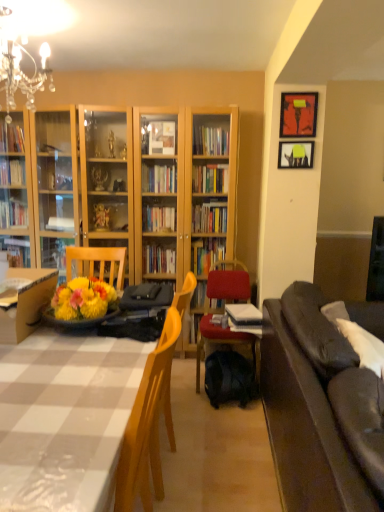
Question: Is dark brown leather couch at right taller than matte black picture frame at upper right, which is counted as the second picture frame, starting from the top?

Choices:
 (A) yes
 (B) no

Answer: (A)

Question: Is dark brown leather couch at right not inside matte black picture frame at upper right, which is the 1th picture frame from bottom to top?

Choices:
 (A) no
 (B) yes

Answer: (B)

Question: Is dark brown leather couch at right at the right side of matte black picture frame at upper right, which is the 1th picture frame from bottom to top?

Choices:
 (A) no
 (B) yes

Answer: (B)

Question: Does dark brown leather couch at right have a lesser width compared to matte black picture frame at upper right, which is the 1th picture frame from bottom to top?

Choices:
 (A) no
 (B) yes

Answer: (A)

Question: Is dark brown leather couch at right surrounding matte black picture frame at upper right, which is the 1th picture frame from bottom to top?

Choices:
 (A) yes
 (B) no

Answer: (B)

Question: In terms of width, does black matte backpack at lower center look wider or thinner when compared to matte black picture frame at upper right, marked as the 1th picture frame in a top-to-bottom arrangement?

Choices:
 (A) thin
 (B) wide

Answer: (B)

Question: Considering the positions of point (213, 353) and point (301, 94), is point (213, 353) closer or farther from the camera than point (301, 94)?

Choices:
 (A) closer
 (B) farther

Answer: (B)

Question: From a real-world perspective, relative to matte black picture frame at upper right, marked as the 1th picture frame in a top-to-bottom arrangement, is black matte backpack at lower center vertically above or below?

Choices:
 (A) above
 (B) below

Answer: (B)

Question: Looking at the image, does black matte backpack at lower center seem bigger or smaller compared to matte black picture frame at upper right, the 2th picture frame ordered from the bottom?

Choices:
 (A) small
 (B) big

Answer: (B)

Question: From the image's perspective, is velvet red chair at center above or below wooden desk at lower left?

Choices:
 (A) above
 (B) below

Answer: (B)

Question: Is velvet red chair at center wider or thinner than wooden desk at lower left?

Choices:
 (A) thin
 (B) wide

Answer: (A)

Question: Looking at the image, does velvet red chair at center seem bigger or smaller compared to wooden desk at lower left?

Choices:
 (A) big
 (B) small

Answer: (A)

Question: Considering the positions of point (238, 289) and point (49, 270), is point (238, 289) closer or farther from the camera than point (49, 270)?

Choices:
 (A) closer
 (B) farther

Answer: (B)

Question: Is point (283, 148) closer or farther from the camera than point (31, 272)?

Choices:
 (A) closer
 (B) farther

Answer: (B)

Question: In terms of size, does matte black picture frame at upper right, which is the 1th picture frame from bottom to top, appear bigger or smaller than wooden desk at lower left?

Choices:
 (A) small
 (B) big

Answer: (A)